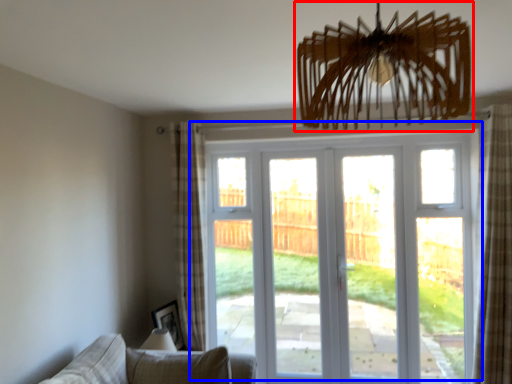
Question: Which of the following is the farthest to the observer, chandelier (highlighted by a red box) or door (highlighted by a blue box)?

Choices:
 (A) chandelier
 (B) door

Answer: (B)